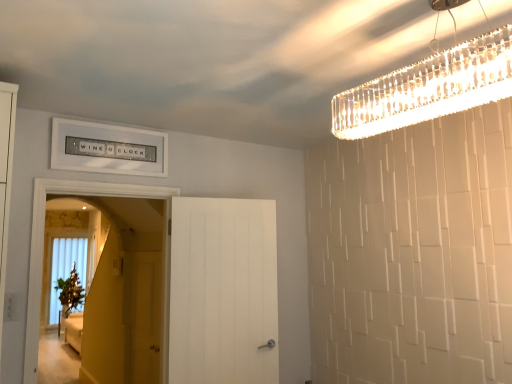
Question: From a real-world perspective, is white matte door at center, the 2th door positioned from the left, below matte yellow screen door at center?

Choices:
 (A) no
 (B) yes

Answer: (A)

Question: Is white matte door at center, the 2th door positioned from the left, positioned beyond the bounds of matte yellow screen door at center?

Choices:
 (A) no
 (B) yes

Answer: (B)

Question: Is white matte door at center, positioned as the 1th door in right-to-left order, taller than matte yellow screen door at center?

Choices:
 (A) yes
 (B) no

Answer: (A)

Question: Is white matte door at center, positioned as the 1th door in right-to-left order, to the left of matte yellow screen door at center from the viewer's perspective?

Choices:
 (A) no
 (B) yes

Answer: (A)

Question: Is white matte door at center, positioned as the 1th door in right-to-left order, turned away from matte yellow screen door at center?

Choices:
 (A) no
 (B) yes

Answer: (B)

Question: From the image's perspective, is white matte door at center, positioned as the 1th door in right-to-left order, above matte yellow screen door at center?

Choices:
 (A) no
 (B) yes

Answer: (B)

Question: Can you confirm if clear crystal chandelier at upper right is thinner than matte yellow screen door at center?

Choices:
 (A) no
 (B) yes

Answer: (A)

Question: Would you consider clear crystal chandelier at upper right to be distant from matte yellow screen door at center?

Choices:
 (A) no
 (B) yes

Answer: (B)

Question: Does clear crystal chandelier at upper right have a lesser height compared to matte yellow screen door at center?

Choices:
 (A) no
 (B) yes

Answer: (B)

Question: From a real-world perspective, is clear crystal chandelier at upper right located beneath matte yellow screen door at center?

Choices:
 (A) yes
 (B) no

Answer: (B)

Question: Is clear crystal chandelier at upper right taller than matte yellow screen door at center?

Choices:
 (A) yes
 (B) no

Answer: (B)

Question: Is clear crystal chandelier at upper right facing away from matte yellow screen door at center?

Choices:
 (A) no
 (B) yes

Answer: (A)

Question: From a real-world perspective, is white wooden door at left, the 2th door from the right, located higher than clear crystal chandelier at upper right?

Choices:
 (A) yes
 (B) no

Answer: (B)